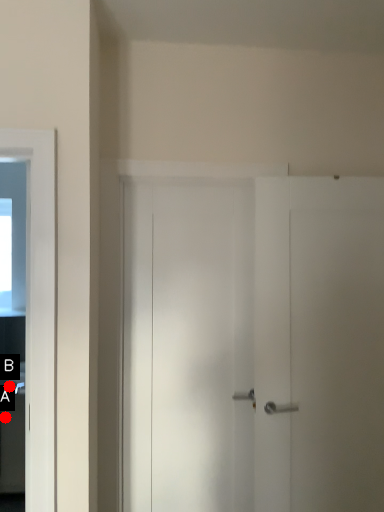
Question: Two points are circled on the image, labeled by A and B beside each circle. Which point appears farthest from the camera in this image?

Choices:
 (A) A is further
 (B) B is further

Answer: (B)